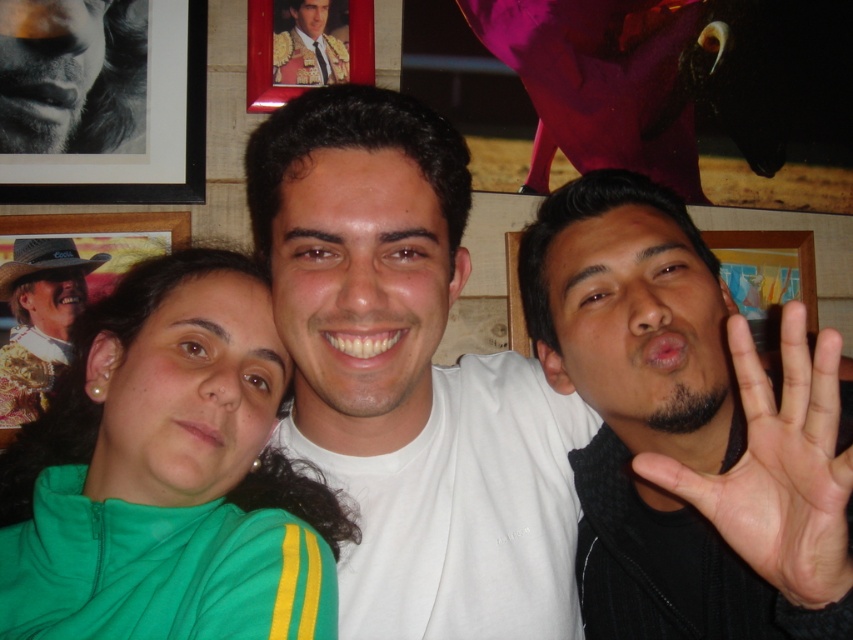
Question: Estimate the real-world distances between objects in this image. Which object is closer to the matte black suit at upper center?

Choices:
 (A) black matte picture frame at upper left
 (B) smooth skin hand at right
 (C) gold embroidered jacket at left

Answer: (A)

Question: Which object is closer to the camera taking this photo?

Choices:
 (A) black matte picture frame at upper left
 (B) matte black suit at upper center
 (C) white matte t-shirt at center

Answer: (C)

Question: Where is white matte t-shirt at center located in relation to smooth skin hand at right in the image?

Choices:
 (A) right
 (B) left

Answer: (B)

Question: Does black matte hand at right have a smaller size compared to matte black suit at upper center?

Choices:
 (A) yes
 (B) no

Answer: (B)

Question: Can you confirm if smooth skin hand at right is smaller than matte black suit at upper center?

Choices:
 (A) yes
 (B) no

Answer: (B)

Question: Among these objects, which one is farthest from the camera?

Choices:
 (A) black matte picture frame at upper left
 (B) metallic gold picture frame at upper center
 (C) matte black phone at right
 (D) white matte t-shirt at center

Answer: (C)